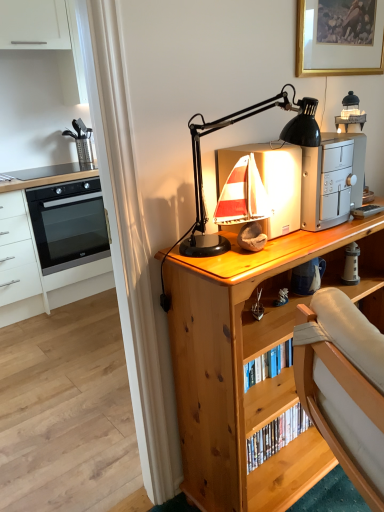
Question: Is silver metallic toaster at upper right, marked as the second appliance in a right-to-left arrangement, positioned behind white ceramic lighthouse at right, which is the 1th appliance from right to left?

Choices:
 (A) no
 (B) yes

Answer: (A)

Question: Can you confirm if silver metallic toaster at upper right, the second appliance positioned from the left, is positioned to the right of white ceramic lighthouse at right, placed as the 3th appliance when sorted from left to right?

Choices:
 (A) yes
 (B) no

Answer: (B)

Question: Considering the relative sizes of silver metallic toaster at upper right, the second appliance positioned from the left, and white ceramic lighthouse at right, placed as the 3th appliance when sorted from left to right, in the image provided, is silver metallic toaster at upper right, the second appliance positioned from the left, taller than white ceramic lighthouse at right, placed as the 3th appliance when sorted from left to right,?

Choices:
 (A) no
 (B) yes

Answer: (B)

Question: Is silver metallic toaster at upper right, marked as the second appliance in a right-to-left arrangement, next to white ceramic lighthouse at right, placed as the 3th appliance when sorted from left to right, and touching it?

Choices:
 (A) no
 (B) yes

Answer: (A)

Question: From the image's perspective, would you say silver metallic toaster at upper right, the second appliance positioned from the left, is positioned over white ceramic lighthouse at right, which is the 1th appliance from right to left?

Choices:
 (A) yes
 (B) no

Answer: (A)

Question: Considering their positions, is black plastic lamp at upper center located in front of or behind white ceramic lighthouse at right, placed as the 3th appliance when sorted from left to right?

Choices:
 (A) behind
 (B) front

Answer: (B)

Question: Is black plastic lamp at upper center to the left or to the right of white ceramic lighthouse at right, placed as the 3th appliance when sorted from left to right, in the image?

Choices:
 (A) left
 (B) right

Answer: (A)

Question: Considering the positions of black plastic lamp at upper center and white ceramic lighthouse at right, which is the 1th appliance from right to left, in the image, is black plastic lamp at upper center bigger or smaller than white ceramic lighthouse at right, which is the 1th appliance from right to left,?

Choices:
 (A) big
 (B) small

Answer: (A)

Question: In terms of width, does black plastic lamp at upper center look wider or thinner when compared to white ceramic lighthouse at right, which is the 1th appliance from right to left?

Choices:
 (A) wide
 (B) thin

Answer: (A)

Question: From a real-world perspective, is white ceramic lighthouse at right, placed as the 3th appliance when sorted from left to right, above or below wooden sailboat at upper center, the third appliance when ordered from right to left?

Choices:
 (A) below
 (B) above

Answer: (A)

Question: Is white ceramic lighthouse at right, placed as the 3th appliance when sorted from left to right, inside the boundaries of wooden sailboat at upper center, the first appliance when ordered from left to right, or outside?

Choices:
 (A) outside
 (B) inside

Answer: (A)

Question: Considering the relative positions of white ceramic lighthouse at right, which is the 1th appliance from right to left, and wooden sailboat at upper center, the third appliance when ordered from right to left, in the image provided, is white ceramic lighthouse at right, which is the 1th appliance from right to left, to the left or to the right of wooden sailboat at upper center, the third appliance when ordered from right to left,?

Choices:
 (A) right
 (B) left

Answer: (A)

Question: Considering their positions, is white ceramic lighthouse at right, which is the 1th appliance from right to left, located in front of or behind wooden sailboat at upper center, the third appliance when ordered from right to left?

Choices:
 (A) front
 (B) behind

Answer: (B)

Question: Is wooden sailboat at upper center, the first appliance when ordered from left to right, inside the boundaries of black plastic lamp at upper center, or outside?

Choices:
 (A) outside
 (B) inside

Answer: (A)

Question: From the image's perspective, relative to black plastic lamp at upper center, is wooden sailboat at upper center, the first appliance when ordered from left to right, above or below?

Choices:
 (A) above
 (B) below

Answer: (A)